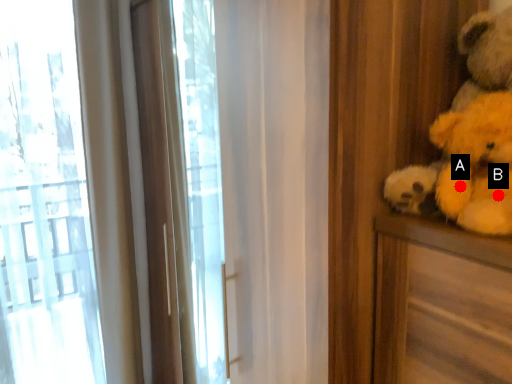
Question: Two points are circled on the image, labeled by A and B beside each circle. Which point is farther to the camera?

Choices:
 (A) A is further
 (B) B is further

Answer: (A)